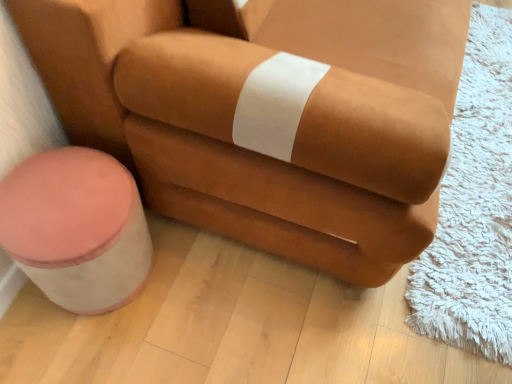
Question: Is suede-like brown armchair at center taller or shorter than pink fabric stool at lower left?

Choices:
 (A) short
 (B) tall

Answer: (B)

Question: From a real-world perspective, is suede-like brown armchair at center physically located above or below pink fabric stool at lower left?

Choices:
 (A) above
 (B) below

Answer: (A)

Question: From the image's perspective, is suede-like brown armchair at center located above or below pink fabric stool at lower left?

Choices:
 (A) below
 (B) above

Answer: (B)

Question: Considering their positions, is pink fabric stool at lower left located in front of or behind suede-like brown armchair at center?

Choices:
 (A) front
 (B) behind

Answer: (B)

Question: From the image's perspective, is pink fabric stool at lower left positioned above or below suede-like brown armchair at center?

Choices:
 (A) below
 (B) above

Answer: (A)

Question: Is pink fabric stool at lower left taller or shorter than suede-like brown armchair at center?

Choices:
 (A) tall
 (B) short

Answer: (B)

Question: Is pink fabric stool at lower left bigger or smaller than suede-like brown armchair at center?

Choices:
 (A) small
 (B) big

Answer: (A)